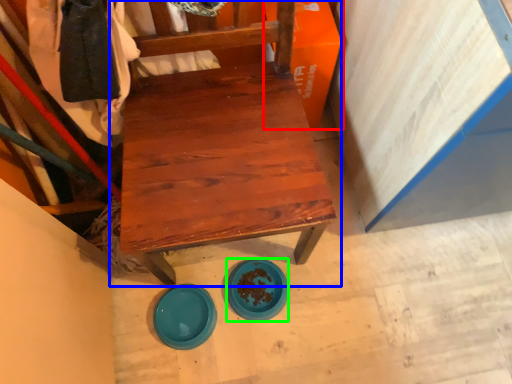
Question: Based on their relative distances, which object is farther from cardboard box (highlighted by a red box)? Choose from chair (highlighted by a blue box) and plate (highlighted by a green box).

Choices:
 (A) chair
 (B) plate

Answer: (B)